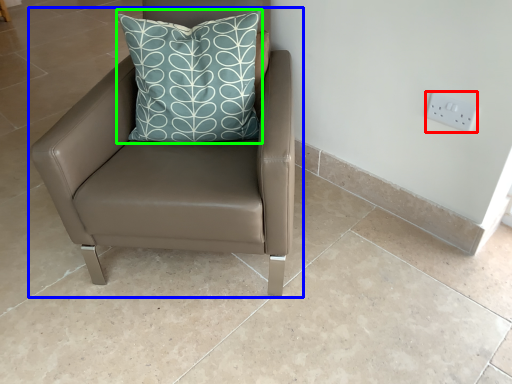
Question: Considering the real-world distances, which object is closest to electric outlet (highlighted by a red box)? chair (highlighted by a blue box) or pillow (highlighted by a green box).

Choices:
 (A) chair
 (B) pillow

Answer: (B)